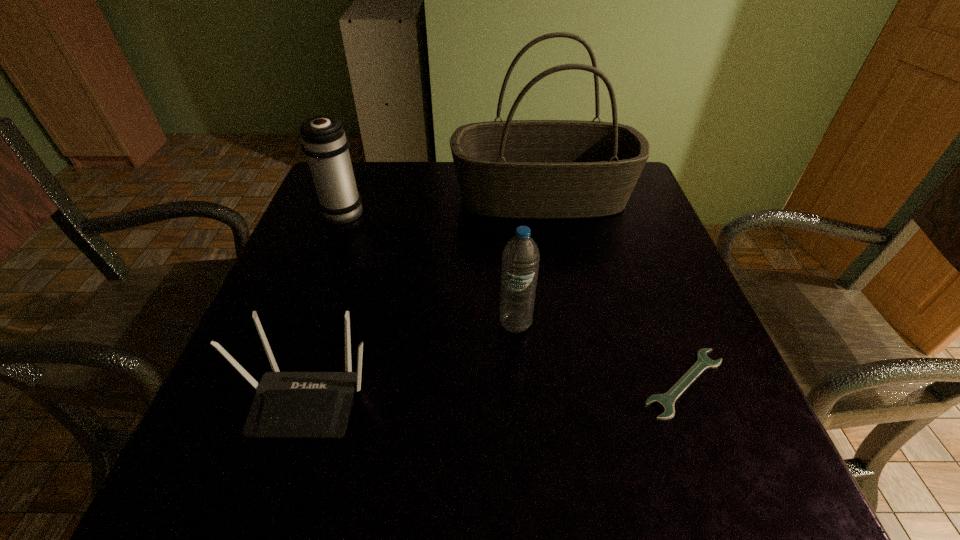
At what (x,y) coordinates should I click in order to perform the action: click on unoccupied area between the third farthest object and the shortest object. Please return your answer as a coordinate pair (x, y). This screenshot has width=960, height=540. Looking at the image, I should click on (600, 354).

Where is `free point between the tallest object and the thermos bottle`? free point between the tallest object and the thermos bottle is located at coordinates (444, 204).

Where is `free space that is in between the third farthest object and the thermos bottle`? The height and width of the screenshot is (540, 960). free space that is in between the third farthest object and the thermos bottle is located at coordinates (429, 267).

Locate an element on the screen. Image resolution: width=960 pixels, height=540 pixels. object that is the closest to the third nearest object is located at coordinates (665, 401).

This screenshot has height=540, width=960. Find the location of `object that can be found as the closest to the thermos bottle`. object that can be found as the closest to the thermos bottle is located at coordinates (526, 169).